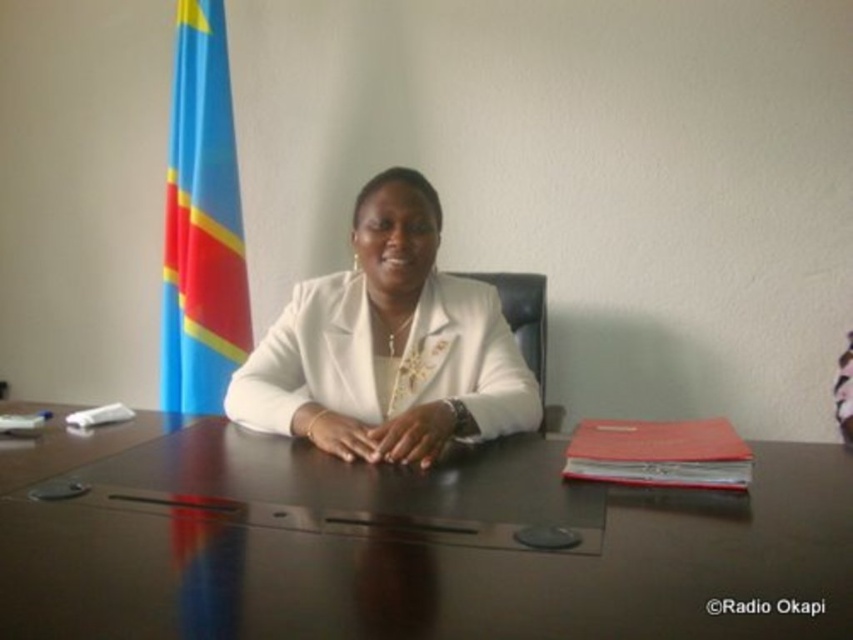
Question: Does dark brown polished wood table at center have a larger size compared to white glossy jacket at center?

Choices:
 (A) yes
 (B) no

Answer: (A)

Question: Is dark brown polished wood table at center to the left of white glossy jacket at center from the viewer's perspective?

Choices:
 (A) no
 (B) yes

Answer: (B)

Question: Which point is closer to the camera taking this photo?

Choices:
 (A) (416, 240)
 (B) (277, 634)

Answer: (B)

Question: From the image, what is the correct spatial relationship of dark brown polished wood table at center in relation to white glossy jacket at center?

Choices:
 (A) right
 (B) left

Answer: (B)